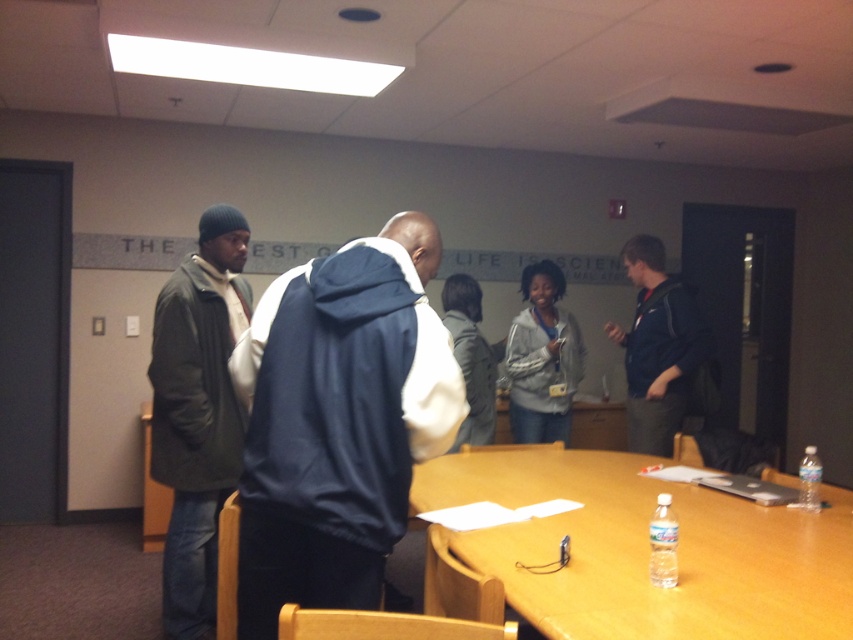
You are standing in the meeting room and want to move from point A to point B. Point A is at coordinate point point (x=804, y=573) and point B is at coordinate point (x=532, y=353). Since you can only move forward, will you be able to reach point B without turning around?

Point point (x=804, y=573) is closer to the viewer than point point (x=532, y=353). Therefore, moving forward from point A to point B would require moving away from the viewer, meaning you cannot reach point B without turning around.